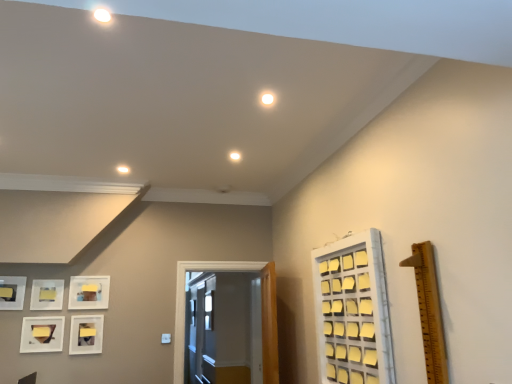
Question: Is matte white picture frame at lower left, which is counted as the 1th picture frame, starting from the right, taller or shorter than wooden ruler at right?

Choices:
 (A) short
 (B) tall

Answer: (A)

Question: Considering the positions of matte white picture frame at lower left, arranged as the 5th picture frame when viewed from the left, and wooden ruler at right in the image, is matte white picture frame at lower left, arranged as the 5th picture frame when viewed from the left, bigger or smaller than wooden ruler at right?

Choices:
 (A) small
 (B) big

Answer: (A)

Question: Which of these objects is positioned farthest from the wooden ruler at right?

Choices:
 (A) matte white picture frame at upper left, placed as the second picture frame when sorted from left to right
 (B) matte white picture frame at left, arranged as the first picture frame when viewed from the left
 (C) white matte picture frame at lower left, arranged as the fourth picture frame when viewed from the left
 (D) matte white picture frame at lower left, arranged as the 5th picture frame when viewed from the left
 (E) white glossy door at center

Answer: (B)

Question: Estimate the real-world distances between objects in this image. Which object is farther from the white matte picture frame at lower left, the 2th picture frame from the right?

Choices:
 (A) wooden ruler at right
 (B) matte white picture frame at upper left, placed as the second picture frame when sorted from left to right
 (C) white glossy door at center
 (D) matte white picture frame at left, arranged as the first picture frame when viewed from the left
 (E) matte white picture frame at lower left, acting as the third picture frame starting from the right

Answer: (A)